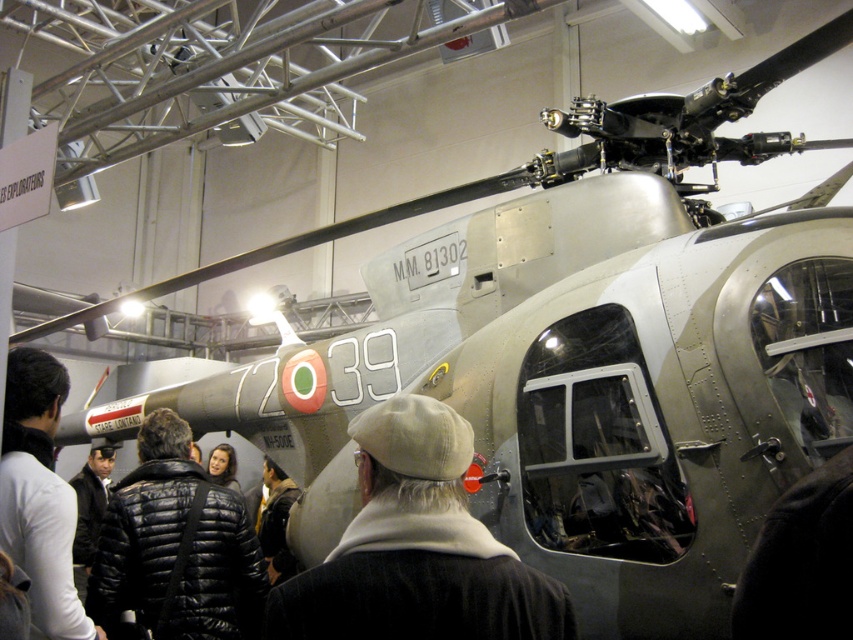
Question: Among these objects, which one is nearest to the camera?

Choices:
 (A) leather jacket at center
 (B) black puffer jacket at center
 (C) black quilted jacket at lower left
 (D) black jacket at center

Answer: (C)

Question: Is black quilted jacket at lower left thinner than leather jacket at center?

Choices:
 (A) no
 (B) yes

Answer: (B)

Question: Does beige woolen hat at center appear on the right side of leather jacket at center?

Choices:
 (A) yes
 (B) no

Answer: (A)

Question: Which point appears farthest from the camera in this image?

Choices:
 (A) (344, 596)
 (B) (71, 540)
 (C) (157, 525)

Answer: (C)

Question: Which object appears closest to the camera in this image?

Choices:
 (A) beige woolen hat at center
 (B) leather jacket at center
 (C) black quilted jacket at lower left

Answer: (A)

Question: Is black quilted jacket at lower left to the right of black jacket at center from the viewer's perspective?

Choices:
 (A) no
 (B) yes

Answer: (B)